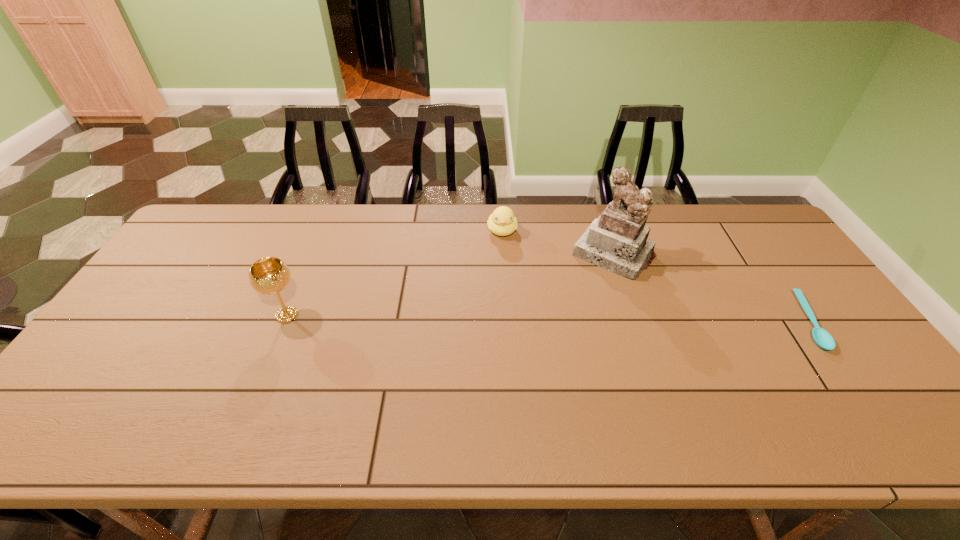
The height and width of the screenshot is (540, 960). I want to click on vacant region at the near edge of the desktop, so click(343, 376).

This screenshot has width=960, height=540. In order to click on vacant space at the right edge of the desktop in this screenshot , I will do `click(776, 254)`.

Image resolution: width=960 pixels, height=540 pixels. I want to click on unoccupied area between the figurine and the third object from right to left, so click(x=558, y=242).

Where is `blank region between the second tallest object and the spoon`? blank region between the second tallest object and the spoon is located at coordinates (547, 318).

Where is `free spot between the leftmost object and the figurine`? Image resolution: width=960 pixels, height=540 pixels. free spot between the leftmost object and the figurine is located at coordinates (450, 285).

I want to click on vacant space that's between the rightmost object and the tallest object, so [x=710, y=288].

You are a GUI agent. You are given a task and a screenshot of the screen. Output one action in this format:
    pyautogui.click(x=<x>, y=<y>)
    Task: Click on the empty location between the tallest object and the second tallest object
    This screenshot has width=960, height=540.
    Given the screenshot: What is the action you would take?
    pyautogui.click(x=450, y=285)

The height and width of the screenshot is (540, 960). Identify the location of unoccupied position between the leftmost object and the figurine. (450, 285).

Where is `vacant area that lies between the figurine and the rightmost object`? vacant area that lies between the figurine and the rightmost object is located at coordinates click(x=710, y=288).

The image size is (960, 540). I want to click on vacant area between the tallest object and the third object from right to left, so click(x=558, y=242).